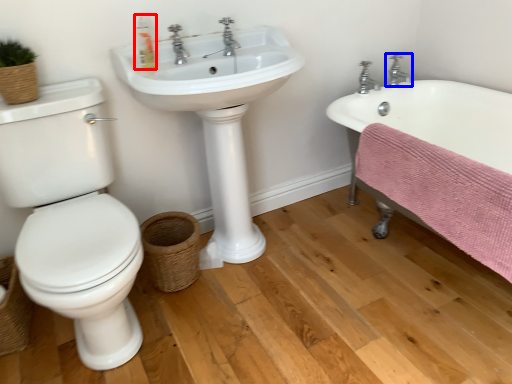
Question: Among these objects, which one is farthest to the camera, soap dispenser (highlighted by a red box) or tap (highlighted by a blue box)?

Choices:
 (A) soap dispenser
 (B) tap

Answer: (B)